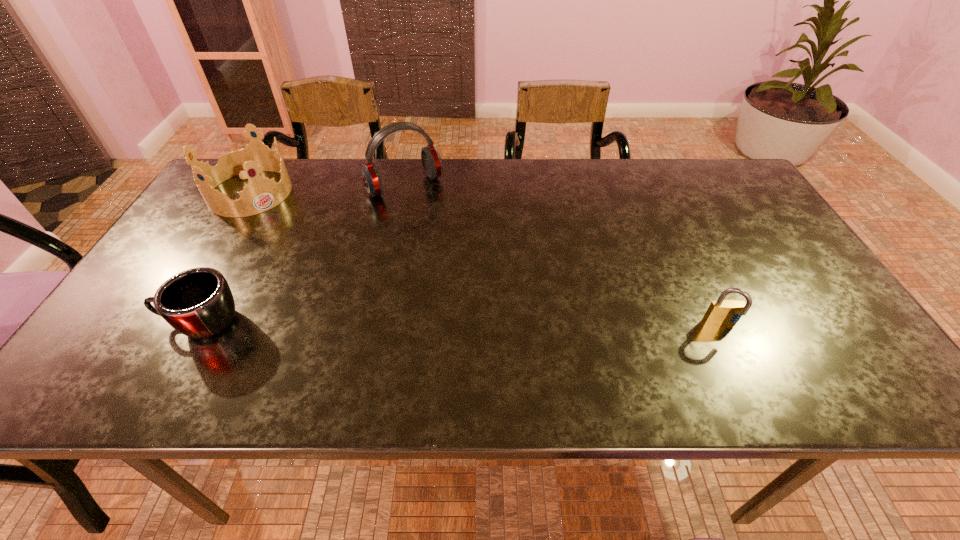
Image resolution: width=960 pixels, height=540 pixels. I want to click on free location at the far edge, so click(535, 163).

The height and width of the screenshot is (540, 960). In order to click on free space at the near edge of the desktop in this screenshot , I will do `click(560, 343)`.

You are a GUI agent. You are given a task and a screenshot of the screen. Output one action in this format:
    pyautogui.click(x=<x>, y=<y>)
    Task: Click on the vacant space at the left edge
    This screenshot has width=960, height=540.
    Given the screenshot: What is the action you would take?
    pyautogui.click(x=211, y=238)

Image resolution: width=960 pixels, height=540 pixels. In order to click on free space between the mug and the tallest object in this screenshot , I will do `click(302, 254)`.

Locate an element on the screen. The width and height of the screenshot is (960, 540). free space between the rightmost object and the tallest object is located at coordinates (563, 256).

I want to click on vacant region between the tiara and the mug, so click(x=226, y=258).

In order to click on unoccupied position between the rightmost object and the mug in this screenshot , I will do `click(461, 324)`.

This screenshot has height=540, width=960. What are the coordinates of `free space between the mug and the second tallest object` in the screenshot? It's located at (226, 258).

At what (x,y) coordinates should I click in order to perform the action: click on free space between the mug and the padlock. Please return your answer as a coordinate pair (x, y). The image size is (960, 540). Looking at the image, I should click on point(461,324).

Locate an element on the screen. The width and height of the screenshot is (960, 540). free space between the second tallest object and the mug is located at coordinates (226, 258).